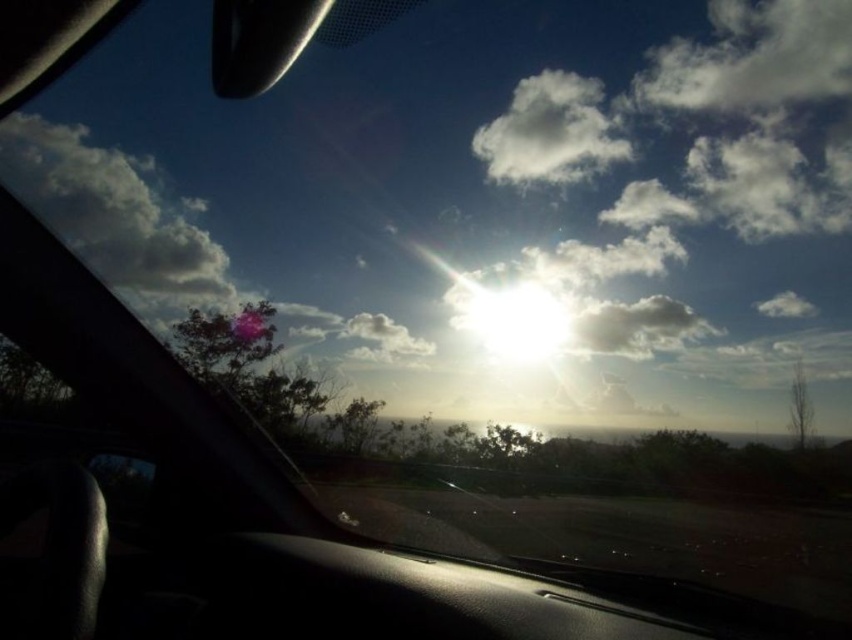
Question: Does white fluffy cloud at upper right have a lesser width compared to white fluffy cloud at upper center?

Choices:
 (A) no
 (B) yes

Answer: (A)

Question: Does white fluffy cloud at upper left have a greater width compared to white fluffy cloud at upper center?

Choices:
 (A) yes
 (B) no

Answer: (B)

Question: Which point is farther to the camera?

Choices:
 (A) (826, 24)
 (B) (159, 275)
 (C) (487, 154)

Answer: (A)

Question: Considering the real-world distances, which object is farthest from the white fluffy cloud at upper left?

Choices:
 (A) white fluffy cloud at upper center
 (B) white fluffy cloud at upper right

Answer: (B)

Question: Estimate the real-world distances between objects in this image. Which object is farther from the white fluffy cloud at upper left?

Choices:
 (A) white fluffy cloud at upper right
 (B) white fluffy cloud at upper center

Answer: (A)

Question: Is white fluffy cloud at upper left wider than white fluffy cloud at upper center?

Choices:
 (A) no
 (B) yes

Answer: (A)